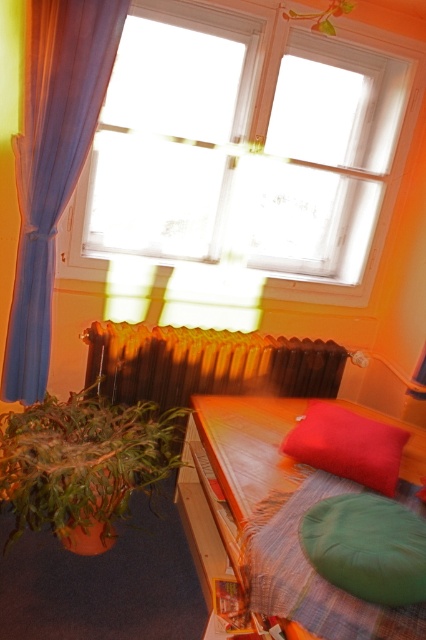
Question: Among these objects, which one is nearest to the camera?

Choices:
 (A) wooden bed frame at lower right
 (B) green leafy plant at lower left
 (C) white glass window at upper center

Answer: (A)

Question: Among these objects, which one is farthest from the camera?

Choices:
 (A) white glass window at upper center
 (B) green fabric pillow at lower right
 (C) blue sheer curtain at left

Answer: (A)

Question: Is blue sheer curtain at left above white glass window at upper center?

Choices:
 (A) yes
 (B) no

Answer: (B)

Question: Is blue sheer curtain at left positioned before rustic metal radiator at center?

Choices:
 (A) no
 (B) yes

Answer: (B)

Question: Which object is the farthest from the green fabric pillow at lower right?

Choices:
 (A) matte red pillow at center
 (B) rustic metal radiator at center
 (C) white glass window at upper center
 (D) green leafy plant at lower left

Answer: (C)

Question: In this image, where is blue sheer curtain at left located relative to matte red pillow at center?

Choices:
 (A) above
 (B) below

Answer: (A)